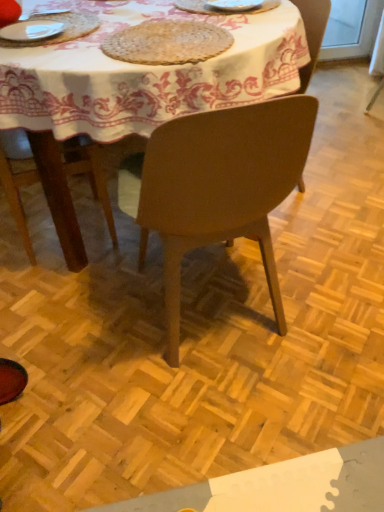
Where is `vacant area located to the right-hand side of white glossy plate at upper left`? The height and width of the screenshot is (512, 384). vacant area located to the right-hand side of white glossy plate at upper left is located at coordinates (99, 32).